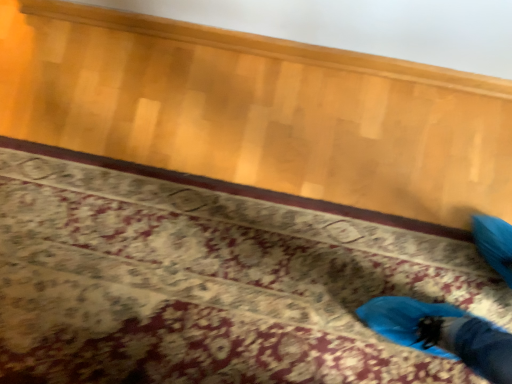
The height and width of the screenshot is (384, 512). In order to click on patterned carpet at center in this screenshot , I will do `click(211, 279)`.

What do you see at coordinates (211, 279) in the screenshot?
I see `patterned carpet at center` at bounding box center [211, 279].

Image resolution: width=512 pixels, height=384 pixels. Find the location of `patterned carpet at center`. patterned carpet at center is located at coordinates (211, 279).